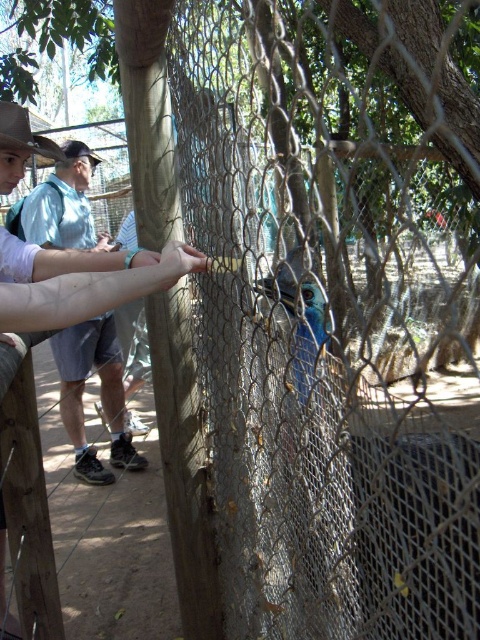
Is point (126, 444) positioned after point (28, 148)?

That is True.

Who is taller, light blue shirt at center or brown leather cowboy hat at upper left?

Standing taller between the two is light blue shirt at center.

This screenshot has height=640, width=480. What do you see at coordinates (100, 396) in the screenshot?
I see `light blue shirt at center` at bounding box center [100, 396].

Identify the location of light blue shirt at center. This screenshot has height=640, width=480. (x=100, y=396).

Is light blue shirt at center to the right of smooth skin hand at center from the viewer's perspective?

No, light blue shirt at center is not to the right of smooth skin hand at center.

Is light blue shirt at center below smooth skin hand at center?

A: Correct, light blue shirt at center is located below smooth skin hand at center.

Is point (129, 307) farther from camera compared to point (192, 250)?

Yes, it is.

The width and height of the screenshot is (480, 640). What are the coordinates of `light blue shirt at center` in the screenshot? It's located at (100, 396).

Which of these two, smooth skin hand at center or brown leather cowboy hat at upper left, stands taller?

With more height is smooth skin hand at center.

Which of these two, smooth skin hand at center or brown leather cowboy hat at upper left, stands shorter?

brown leather cowboy hat at upper left is shorter.

I want to click on smooth skin hand at center, so click(x=85, y=269).